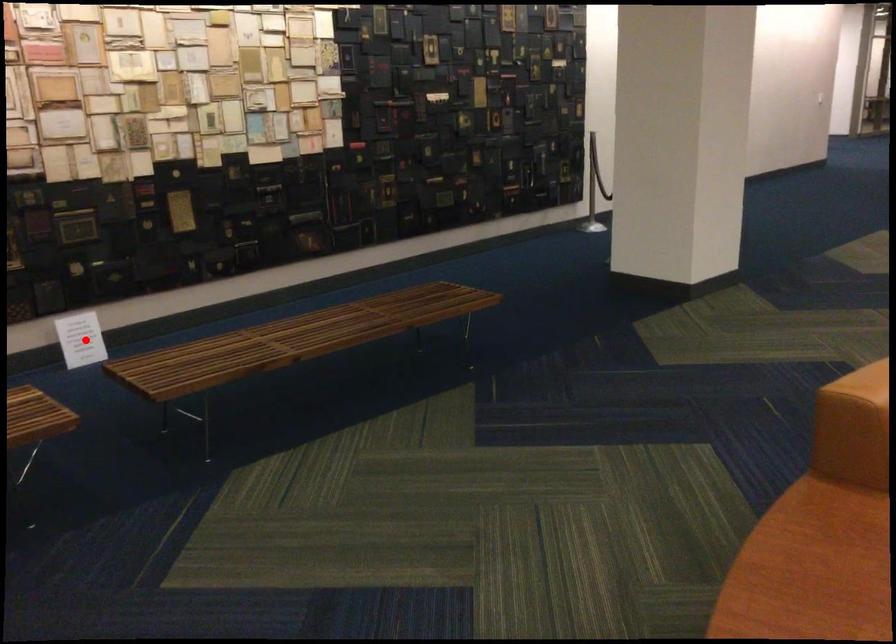
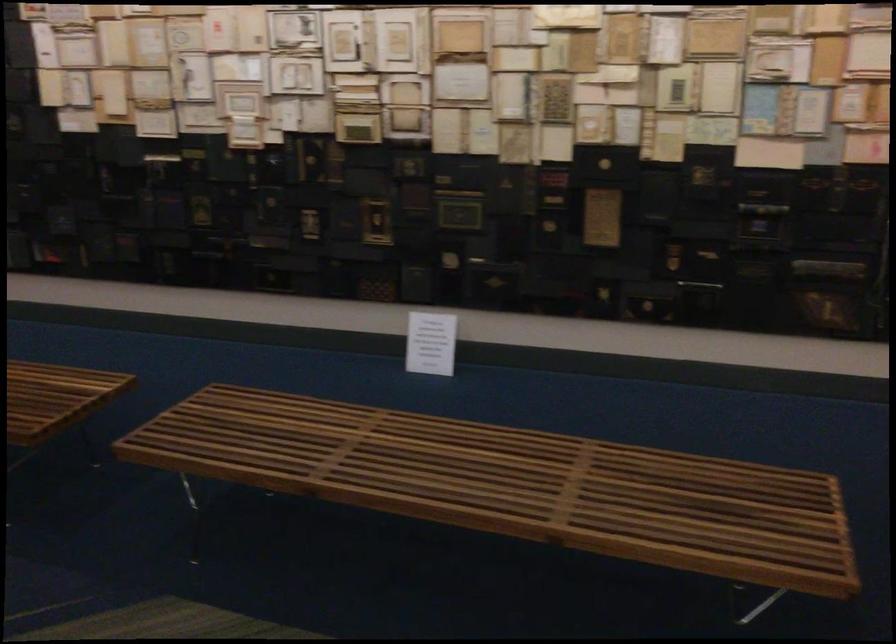
Question: A red point is marked in image1. In image2, is the corresponding 3D point closer to the camera or farther? Reply with the corresponding letter.

Choices:
 (A) The corresponding 3D point is closer.
 (B) The corresponding 3D point is farther.

Answer: (A)